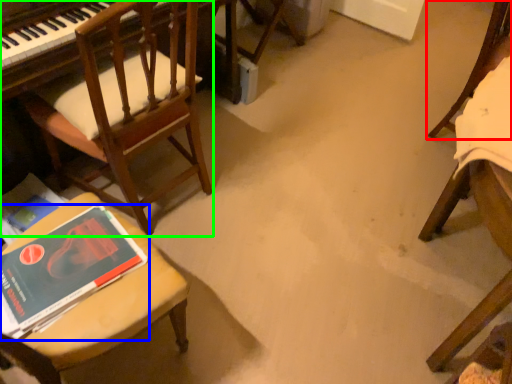
Question: Which is farther away from chair (highlighted by a red box)? book (highlighted by a blue box) or chair (highlighted by a green box)?

Choices:
 (A) book
 (B) chair

Answer: (A)